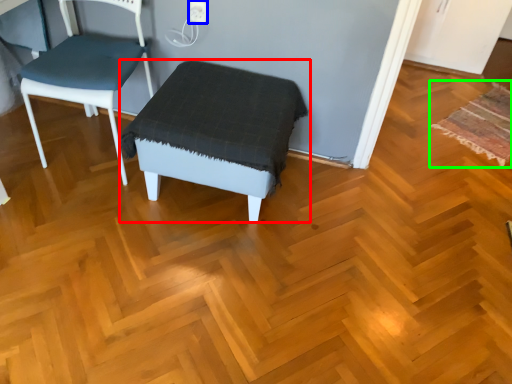
Question: Estimate the real-world distances between objects in this image. Which object is farther from stool (highlighted by a red box), electric outlet (highlighted by a blue box) or mat (highlighted by a green box)?

Choices:
 (A) electric outlet
 (B) mat

Answer: (B)